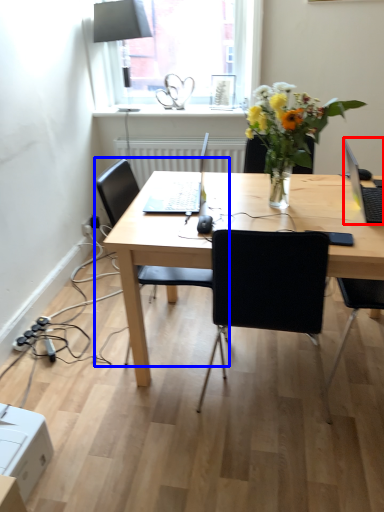
Question: Which of the following is the closest to the observer, laptop (highlighted by a red box) or chair (highlighted by a blue box)?

Choices:
 (A) laptop
 (B) chair

Answer: (A)